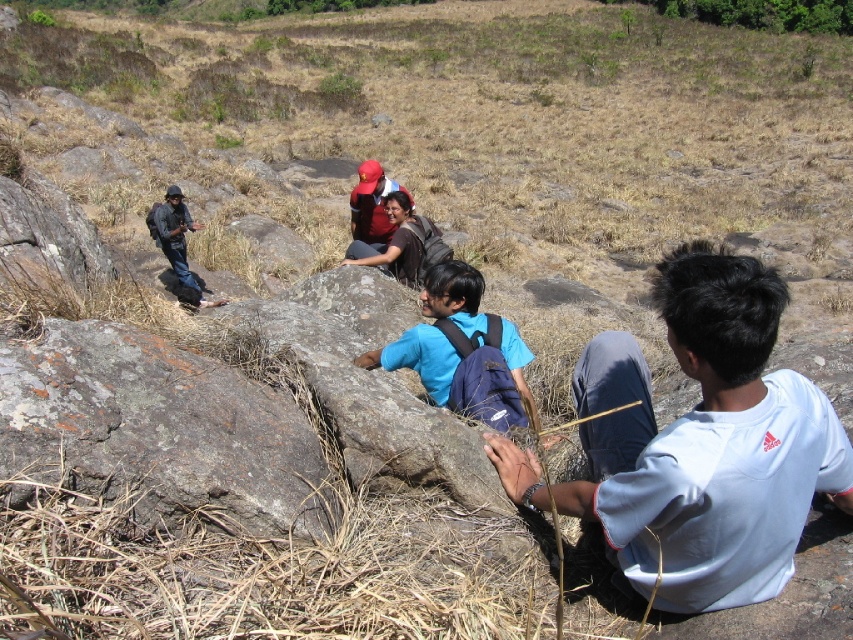
Question: Which object is positioned closest to the blue fabric backpack at center?

Choices:
 (A) rusty stone boulder at left
 (B) white cotton shirt at lower right

Answer: (B)

Question: Which point is farther to the camera?

Choices:
 (A) rusty stone boulder at left
 (B) white cotton shirt at lower right
 (C) blue fabric backpack at center

Answer: (C)

Question: Is white cotton shirt at lower right below rusty stone boulder at left?

Choices:
 (A) yes
 (B) no

Answer: (A)

Question: Which object appears farthest from the camera in this image?

Choices:
 (A) rusty stone boulder at left
 (B) white cotton shirt at lower right
 (C) blue fabric backpack at center

Answer: (C)

Question: Does white cotton shirt at lower right appear on the right side of rusty stone boulder at left?

Choices:
 (A) no
 (B) yes

Answer: (B)

Question: From the image, what is the correct spatial relationship of white cotton shirt at lower right in relation to rusty stone boulder at left?

Choices:
 (A) above
 (B) below

Answer: (B)